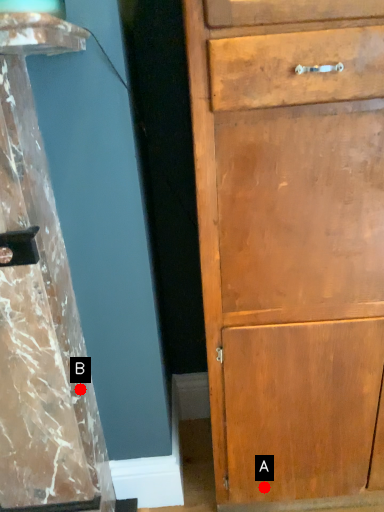
Question: Two points are circled on the image, labeled by A and B beside each circle. Among these points, which one is nearest to the camera?

Choices:
 (A) A is closer
 (B) B is closer

Answer: (B)